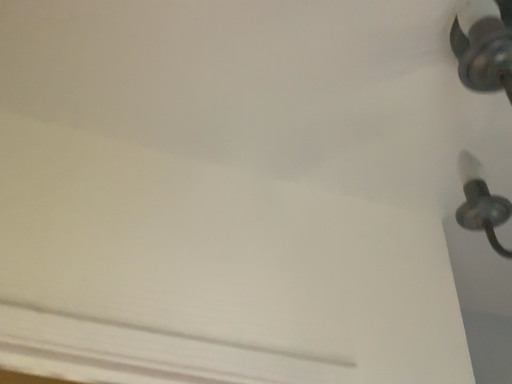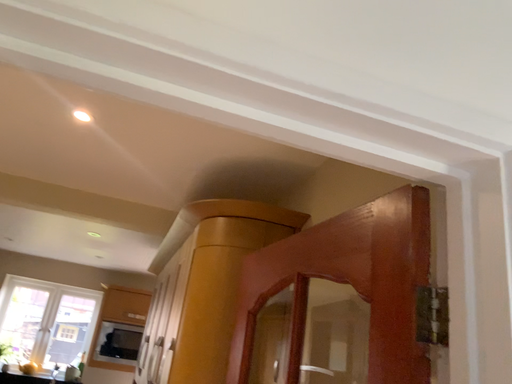
Question: How did the camera likely rotate when shooting the video?

Choices:
 (A) rotated upward
 (B) rotated downward

Answer: (B)